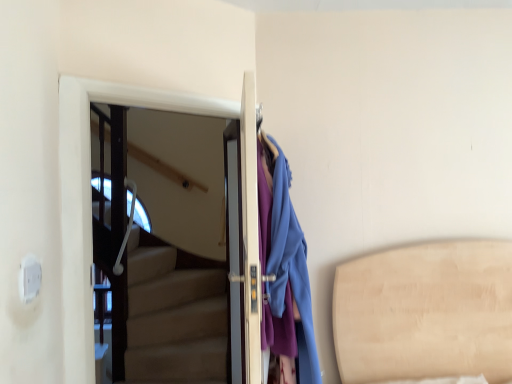
What do you see at coordinates (90, 200) in the screenshot? I see `white glossy door at upper left, placed as the first door when sorted from left to right` at bounding box center [90, 200].

The image size is (512, 384). Identify the location of matte blue coat at right. (283, 272).

In the image, is matte white door at center, acting as the 1th door starting from the right, positioned in front of or behind white glossy door at upper left, the 2th door from the right?

Visually, matte white door at center, acting as the 1th door starting from the right, is located in front of white glossy door at upper left, the 2th door from the right.

Measure the distance between matte white door at center, acting as the 1th door starting from the right, and white glossy door at upper left, placed as the first door when sorted from left to right.

matte white door at center, acting as the 1th door starting from the right, is 25.51 inches away from white glossy door at upper left, placed as the first door when sorted from left to right.

Is matte white door at center, which ranks as the 2th door in left-to-right order, positioned with its back to white glossy door at upper left, placed as the first door when sorted from left to right?

Yes.

Where is `door on the right side of white glossy door at upper left, placed as the first door when sorted from left to right`? door on the right side of white glossy door at upper left, placed as the first door when sorted from left to right is located at coordinates (250, 227).

Which point is more forward, [273,172] or [70,352]?

The point [273,172] is closer.

Is matte blue coat at right taller than white glossy door at upper left, placed as the first door when sorted from left to right?

No.

Is matte blue coat at right outside of white glossy door at upper left, placed as the first door when sorted from left to right?

Yes, matte blue coat at right is outside of white glossy door at upper left, placed as the first door when sorted from left to right.

Does matte blue coat at right have a lesser width compared to matte white door at center, acting as the 1th door starting from the right?

Incorrect, the width of matte blue coat at right is not less than that of matte white door at center, acting as the 1th door starting from the right.

In the scene shown: Can you confirm if matte blue coat at right is positioned to the left of matte white door at center, acting as the 1th door starting from the right?

In fact, matte blue coat at right is to the right of matte white door at center, acting as the 1th door starting from the right.

Considering the sizes of objects matte blue coat at right and matte white door at center, which ranks as the 2th door in left-to-right order, in the image provided, who is shorter, matte blue coat at right or matte white door at center, which ranks as the 2th door in left-to-right order,?

matte white door at center, which ranks as the 2th door in left-to-right order, is shorter.

From the image's perspective, is matte blue coat at right over matte white door at center, acting as the 1th door starting from the right?

Yes, from the image's perspective, matte blue coat at right is on top of matte white door at center, acting as the 1th door starting from the right.

Does white glossy door at upper left, placed as the first door when sorted from left to right, turn towards matte white door at center, which ranks as the 2th door in left-to-right order?

Yes, white glossy door at upper left, placed as the first door when sorted from left to right, faces towards matte white door at center, which ranks as the 2th door in left-to-right order.

From the image's perspective, between white glossy door at upper left, placed as the first door when sorted from left to right, and matte white door at center, acting as the 1th door starting from the right, which one is located above?

white glossy door at upper left, placed as the first door when sorted from left to right, is shown above in the image.

Does white glossy door at upper left, placed as the first door when sorted from left to right, have a smaller size compared to matte white door at center, which ranks as the 2th door in left-to-right order?

Correct, white glossy door at upper left, placed as the first door when sorted from left to right, occupies less space than matte white door at center, which ranks as the 2th door in left-to-right order.

Is white glossy door at upper left, the 2th door from the right, with matte white door at center, which ranks as the 2th door in left-to-right order?

white glossy door at upper left, the 2th door from the right, and matte white door at center, which ranks as the 2th door in left-to-right order, are clearly separated.

Considering the sizes of objects matte white door at center, acting as the 1th door starting from the right, and matte blue coat at right in the image provided, who is thinner, matte white door at center, acting as the 1th door starting from the right, or matte blue coat at right?

matte white door at center, acting as the 1th door starting from the right, is thinner.

From a real-world perspective, which is physically below, matte white door at center, which ranks as the 2th door in left-to-right order, or matte blue coat at right?

matte blue coat at right is physically lower.

In the scene shown: Is matte white door at center, acting as the 1th door starting from the right, not within matte blue coat at right?

No, matte white door at center, acting as the 1th door starting from the right, is inside or overlapping with matte blue coat at right.

Based on the photo, who is taller, matte white door at center, which ranks as the 2th door in left-to-right order, or matte blue coat at right?

With more height is matte blue coat at right.

Could you tell me if white glossy door at upper left, placed as the first door when sorted from left to right, is turned towards matte blue coat at right?

Yes, white glossy door at upper left, placed as the first door when sorted from left to right, is facing matte blue coat at right.

Is white glossy door at upper left, the 2th door from the right, bigger than matte blue coat at right?

No, white glossy door at upper left, the 2th door from the right, is not bigger than matte blue coat at right.

Can you confirm if white glossy door at upper left, the 2th door from the right, is thinner than matte blue coat at right?

Yes.

Considering their positions, is white glossy door at upper left, the 2th door from the right, located in front of or behind matte blue coat at right?

white glossy door at upper left, the 2th door from the right, is behind matte blue coat at right.

Locate an element on the screen. door on the right of white glossy door at upper left, placed as the first door when sorted from left to right is located at coordinates (250, 227).

This screenshot has height=384, width=512. Find the location of `the 2nd door to the left of the matte blue coat at right, counting from the anchor's position`. the 2nd door to the left of the matte blue coat at right, counting from the anchor's position is located at coordinates (90, 200).

Looking at this image, which object lies further to the anchor point matte blue coat at right, white glossy door at upper left, placed as the first door when sorted from left to right, or matte white door at center, acting as the 1th door starting from the right?

Among the two, white glossy door at upper left, placed as the first door when sorted from left to right, is located further to matte blue coat at right.

Estimate the real-world distances between objects in this image. Which object is further from white glossy door at upper left, the 2th door from the right, matte white door at center, which ranks as the 2th door in left-to-right order, or matte blue coat at right?

matte blue coat at right.

Looking at the image, which one is located closer to matte white door at center, acting as the 1th door starting from the right, matte blue coat at right or white glossy door at upper left, the 2th door from the right?

The object closer to matte white door at center, acting as the 1th door starting from the right, is matte blue coat at right.

Considering their positions, is matte blue coat at right positioned closer to white glossy door at upper left, the 2th door from the right, than matte white door at center, which ranks as the 2th door in left-to-right order?

matte white door at center, which ranks as the 2th door in left-to-right order, lies closer to white glossy door at upper left, the 2th door from the right, than the other object.

When comparing their distances from matte white door at center, which ranks as the 2th door in left-to-right order, does white glossy door at upper left, placed as the first door when sorted from left to right, or matte blue coat at right seem further?

The object further to matte white door at center, which ranks as the 2th door in left-to-right order, is white glossy door at upper left, placed as the first door when sorted from left to right.

Estimate the real-world distances between objects in this image. Which object is further from matte blue coat at right, matte white door at center, which ranks as the 2th door in left-to-right order, or white glossy door at upper left, the 2th door from the right?

white glossy door at upper left, the 2th door from the right, is positioned further to the anchor matte blue coat at right.

The image size is (512, 384). Find the location of `door between white glossy door at upper left, the 2th door from the right, and matte blue coat at right from left to right`. door between white glossy door at upper left, the 2th door from the right, and matte blue coat at right from left to right is located at coordinates pyautogui.click(x=250, y=227).